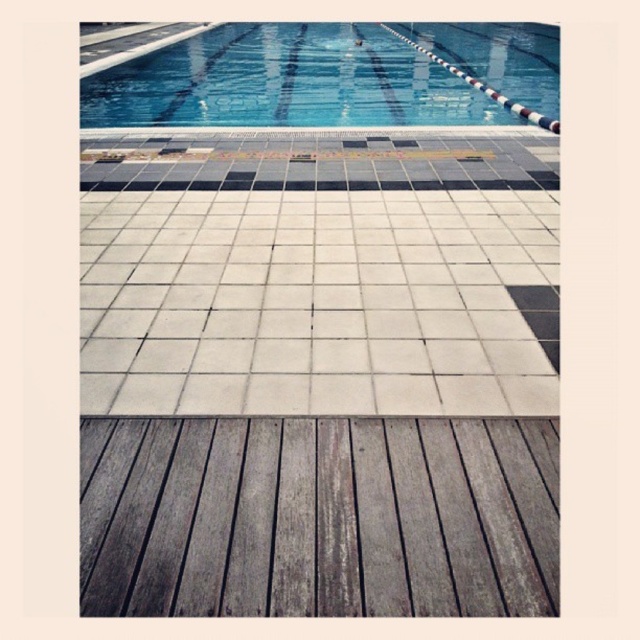
You are standing on the wooden deck and want to reach the pool edge. Which object, the gray weathered wood plank at center or the blue glossy water at upper center, is closer to you as you move towards the pool?

The gray weathered wood plank at center is closer to you than the blue glossy water at upper center as you move towards the pool edge.

You are standing at the point marked as point (x=404, y=568) in the swimming pool area. If you want to take a photo of the entire pool, would your current position allow you to capture the entire pool in the frame?

The point (x=404, y=568) is 1.77 meters away from the camera. However, the question is about capturing the entire pool, which requires considering the field of view and the position relative to the pool. Since the description only provides the distance between the point and the camera, we cannot definitively determine if the entire pool is in frame without additional information about the camera angle or field of view.

In the scene shown: You are standing on the wooden deck and want to place a 1.2 meter long surfboard horizontally between the gray weathered wood plank at center and the blue glossy water at upper center. Considering their lengths, will the surfboard fit without overlapping either end?

The gray weathered wood plank at center is shorter than the blue glossy water at upper center. Since the surfboard is 1.2 meters long, it might not fit if the distance between them is less than 1.2 meters. However, the description only provides information about their lengths, not the distance between them. Therefore, we cannot determine if the surfboard will fit based on the given details.